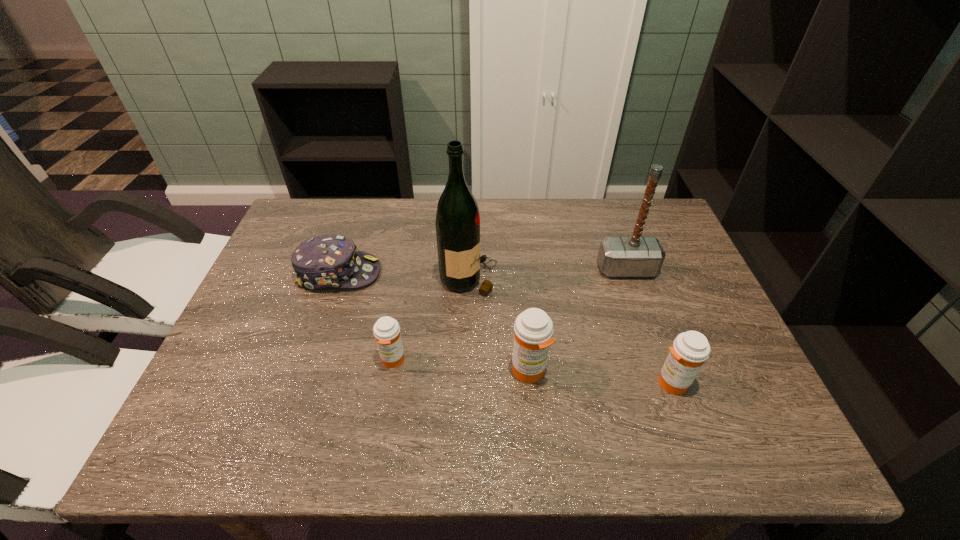
Locate an element on the screen. The height and width of the screenshot is (540, 960). vacant space that satisfies the following two spatial constraints: 1. on the striking surface of the hammer; 2. on the surface of the fourth object from right to left is located at coordinates (630, 278).

At what (x,y) coordinates should I click in order to perform the action: click on vacant region that satisfies the following two spatial constraints: 1. on the striking surface of the hammer; 2. on the front-facing side of the leftmost object. Please return your answer as a coordinate pair (x, y). The width and height of the screenshot is (960, 540). Looking at the image, I should click on coord(628,273).

Locate an element on the screen. The image size is (960, 540). free space that satisfies the following two spatial constraints: 1. on the striking surface of the rightmost medicine; 2. on the right side of the second tallest object is located at coordinates (666, 382).

Locate an element on the screen. free location that satisfies the following two spatial constraints: 1. on the front-facing side of the shortest medicine; 2. on the right side of the headwear is located at coordinates (310, 360).

This screenshot has width=960, height=540. Find the location of `free point that satisfies the following two spatial constraints: 1. on the front-facing side of the leftmost object; 2. on the back side of the shortest medicine`. free point that satisfies the following two spatial constraints: 1. on the front-facing side of the leftmost object; 2. on the back side of the shortest medicine is located at coordinates (310, 360).

Locate an element on the screen. The width and height of the screenshot is (960, 540). free location that satisfies the following two spatial constraints: 1. on the surface of the second medicine from left to right; 2. on the left side of the tallest object is located at coordinates (467, 371).

Image resolution: width=960 pixels, height=540 pixels. I want to click on vacant space that satisfies the following two spatial constraints: 1. on the front-facing side of the shortest object; 2. on the right side of the fifth tallest object, so click(x=310, y=360).

At what (x,y) coordinates should I click in order to perform the action: click on free spot that satisfies the following two spatial constraints: 1. on the surface of the third object from left to right; 2. on the left side of the rightmost medicine. Please return your answer as a coordinate pair (x, y). Looking at the image, I should click on (467, 382).

Find the location of a particular element. free region that satisfies the following two spatial constraints: 1. on the surface of the second shortest medicine; 2. on the left side of the tallest object is located at coordinates (467, 382).

The height and width of the screenshot is (540, 960). I want to click on vacant space that satisfies the following two spatial constraints: 1. on the surface of the tallest object; 2. on the right side of the second shortest medicine, so click(x=467, y=382).